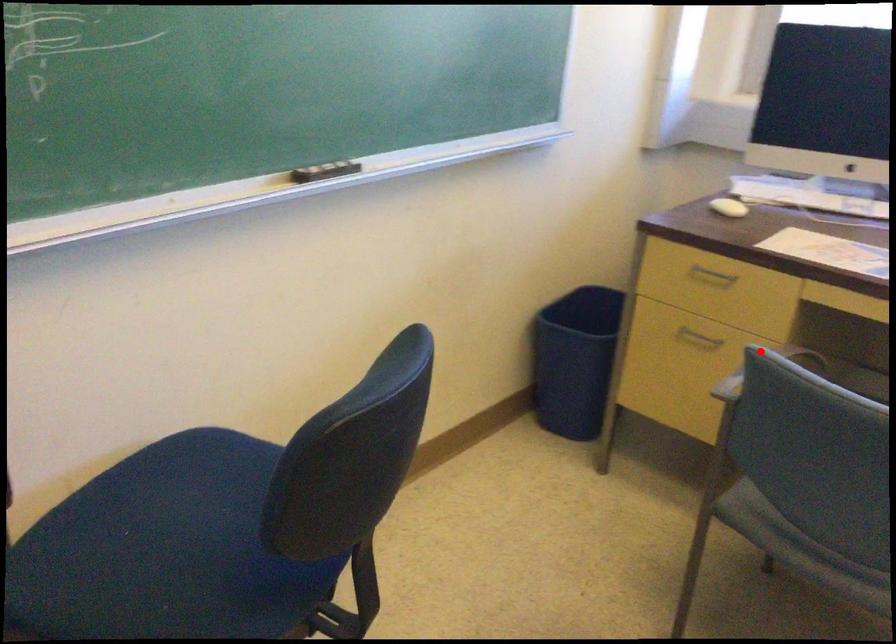
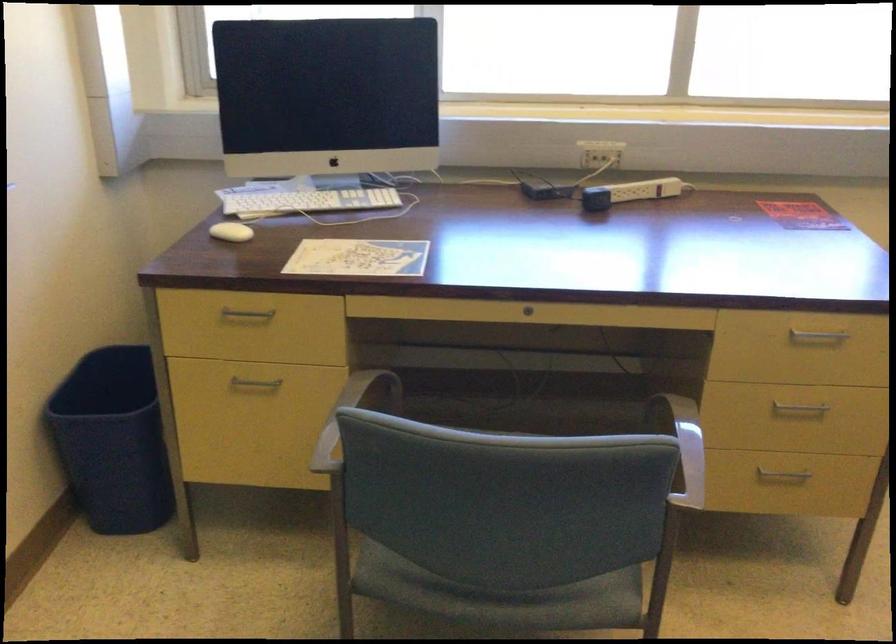
Question: I am providing you with two images of the same scene from different viewpoints. Given a red point in image1, look at the same physical point in image2. Is it:

Choices:
 (A) Closer to the viewpoint
 (B) Farther from the viewpoint

Answer: (A)